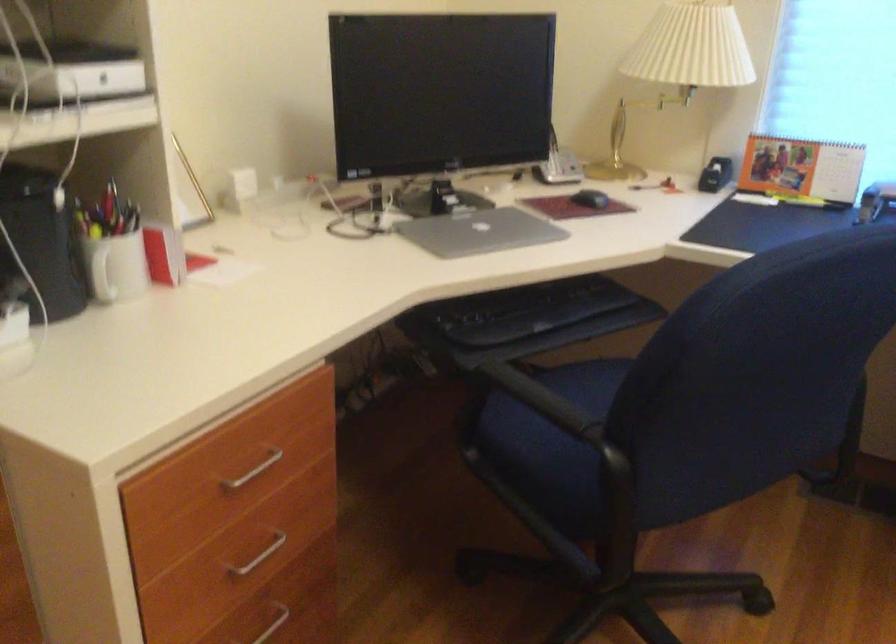
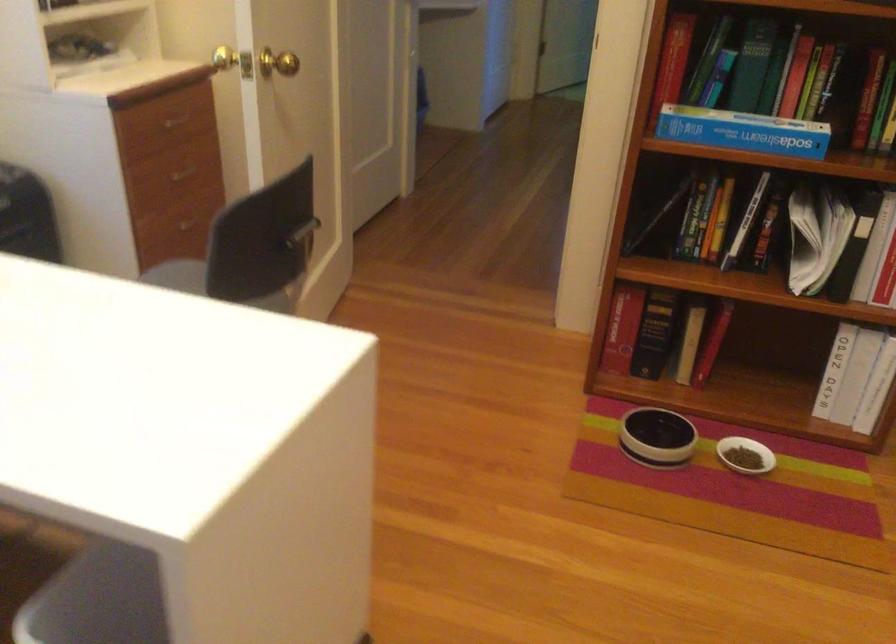
How did the camera likely rotate?

The rotation direction of the camera is right-down.